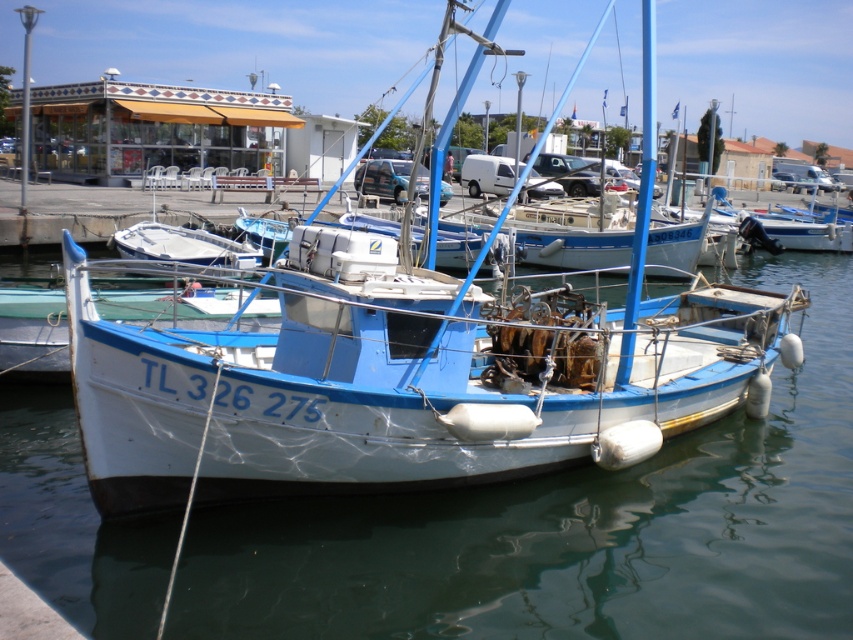
Which is above, white glossy water at center or white matte boat at center?

Positioned higher is white matte boat at center.

Which is behind, point (294, 566) or point (309, 346)?

Point (309, 346)

What are the coordinates of `white glossy water at center` in the screenshot? It's located at (573, 529).